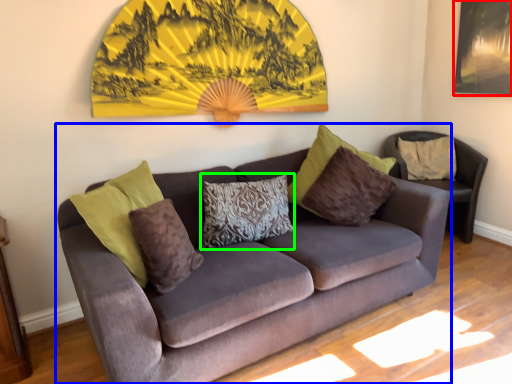
Question: Estimate the real-world distances between objects in this image. Which object is closer to picture frame (highlighted by a red box), studio couch (highlighted by a blue box) or pillow (highlighted by a green box)?

Choices:
 (A) studio couch
 (B) pillow

Answer: (A)